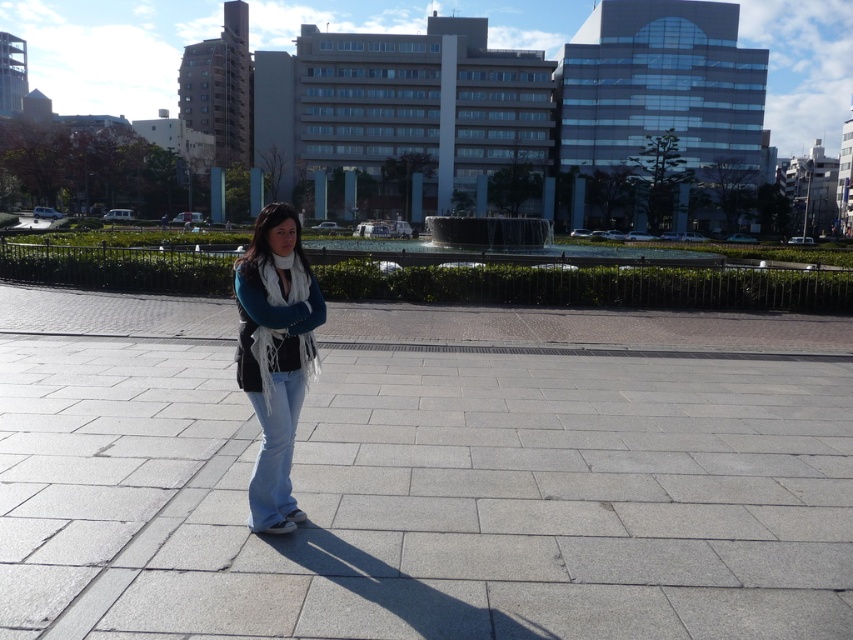
Question: Considering the relative positions of gray concrete pavement at center and denim jeans at center in the image provided, where is gray concrete pavement at center located with respect to denim jeans at center?

Choices:
 (A) below
 (B) above

Answer: (A)

Question: Among these points, which one is farthest from the camera?

Choices:
 (A) (294, 330)
 (B) (264, 444)
 (C) (282, 621)

Answer: (B)

Question: Which object is positioned closest to the denim jeans at center?

Choices:
 (A) light blue denim jeans at center
 (B) gray concrete pavement at center

Answer: (A)

Question: Among these points, which one is farthest from the camera?

Choices:
 (A) (274, 333)
 (B) (6, 557)
 (C) (256, 493)

Answer: (C)

Question: Does gray concrete pavement at center appear under denim jeans at center?

Choices:
 (A) no
 (B) yes

Answer: (B)

Question: Does gray concrete pavement at center appear on the right side of denim jeans at center?

Choices:
 (A) no
 (B) yes

Answer: (B)